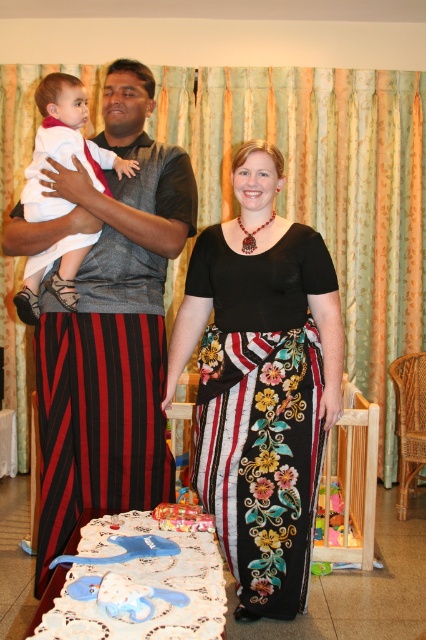
Question: Where is floral fabric skirt at center located in relation to white soft baby at center in the image?

Choices:
 (A) right
 (B) left

Answer: (A)

Question: Does black floral skirt at center appear on the right side of white soft baby at center?

Choices:
 (A) no
 (B) yes

Answer: (B)

Question: Which object appears closest to the camera in this image?

Choices:
 (A) white soft baby at center
 (B) black floral skirt at center

Answer: (A)

Question: Can you confirm if floral fabric skirt at center is positioned to the right of white soft baby at center?

Choices:
 (A) no
 (B) yes

Answer: (B)

Question: Which object is the farthest from the white soft baby at center?

Choices:
 (A) floral fabric skirt at center
 (B) black floral skirt at center

Answer: (B)

Question: Which point is farther from the camera taking this photo?

Choices:
 (A) (270, 493)
 (B) (255, 179)
 (C) (80, 156)

Answer: (B)